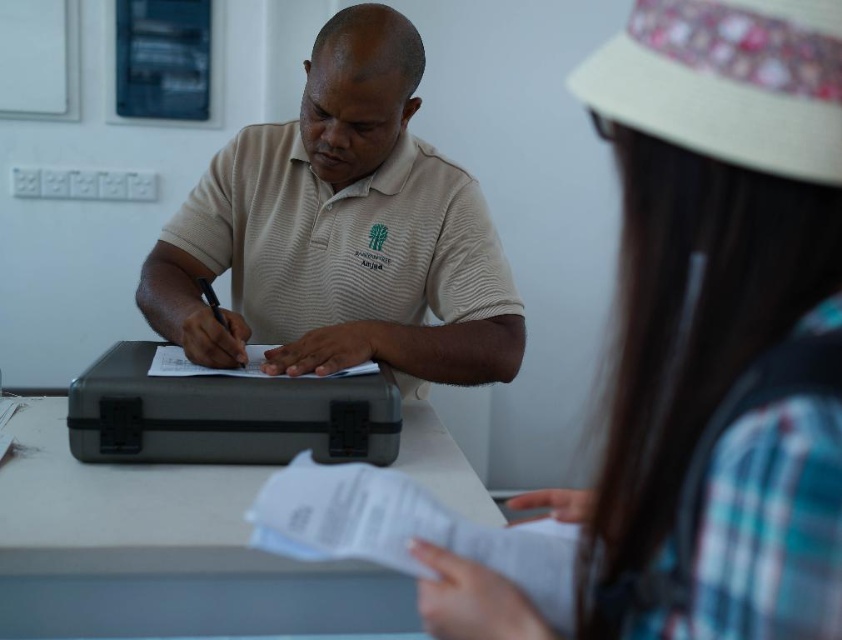
You are a customer service representative standing 6 feet away from the desk. You need to hand a form to the woman wearing the plaid fabric shirt at upper right. Can you reach her without moving closer than 6 feet?

The plaid fabric shirt at upper right is 12.98 inches from viewer, which is less than 6 feet. Therefore, you can reach her without moving closer than 6 feet.

Based on the scene described, can you identify the object located at the coordinate point [718,326]?

The object located at coordinate point [718,326] is the plaid fabric shirt at upper right.

You are a photographer who needs to capture a closeup of the plaid fabric shirt at upper right without moving the camera. Can you confirm if the shirt is within the camera frame?

The plaid fabric shirt at upper right and camera are 12.98 inches apart. Since the camera can focus on objects within 13 inches, the shirt is within the camera frame.